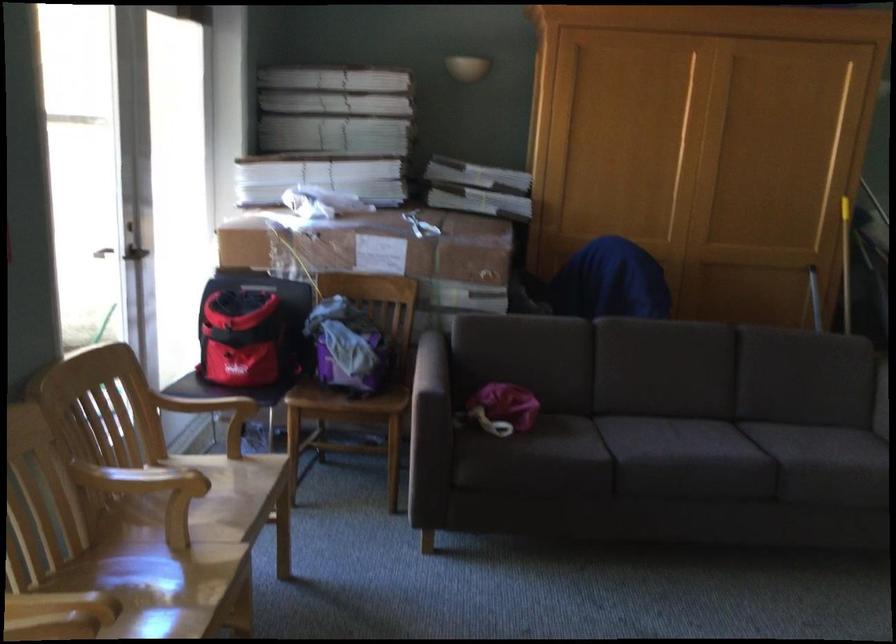
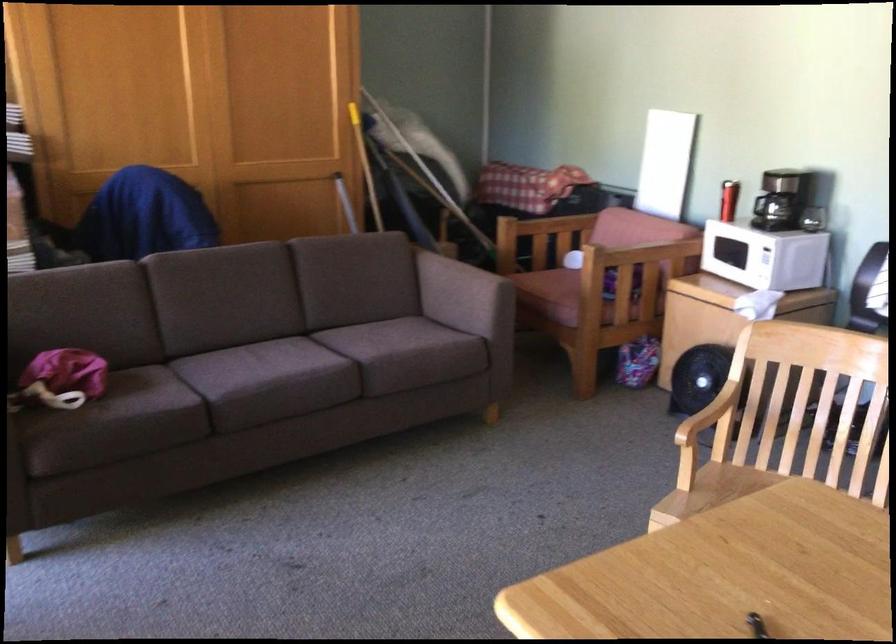
Question: The first image is from the beginning of the video and the second image is from the end. How did the camera likely rotate when shooting the video?

Choices:
 (A) Left
 (B) Right
 (C) Up
 (D) Down

Answer: (B)